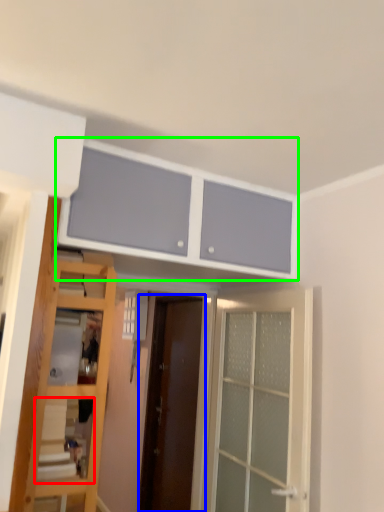
Question: Considering the real-world distances, which object is closest to shelf (highlighted by a red box)? door (highlighted by a blue box) or cabinetry (highlighted by a green box).

Choices:
 (A) door
 (B) cabinetry

Answer: (B)